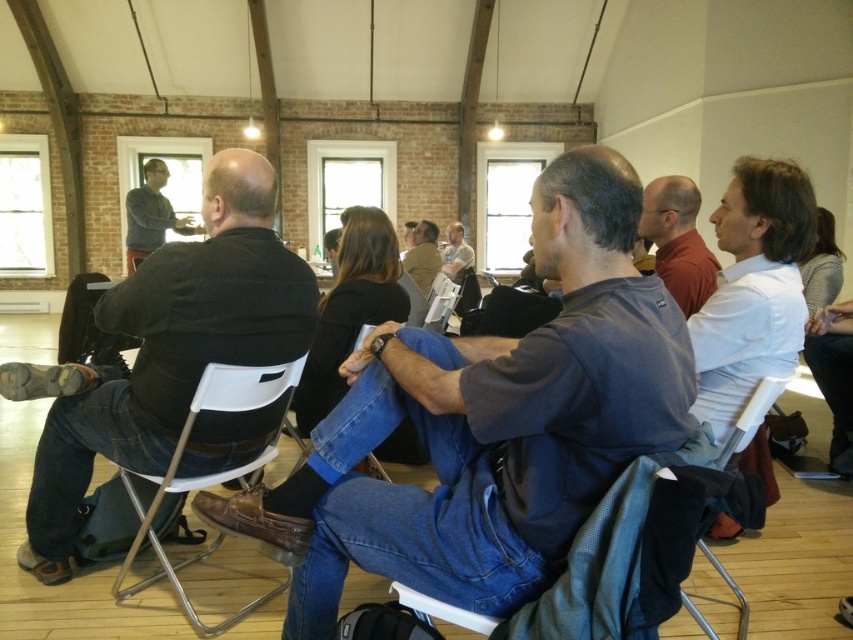
From the picture: You are organizing an event and need to determine if the black leather jacket at left can be placed on the white plastic chair at center without falling off. Based on their sizes, is this possible?

The black leather jacket at left is bigger than the white plastic chair at center, so placing it on the chair may cause it to fall off due to its larger size.

You are standing at the back of the room and want to walk to the front where the presenter is. Which object, the dark blue jeans at center or the white plastic chair at lower left, would you pass closer to as you move forward?

As you move forward from the back of the room, you would pass closer to the dark blue jeans at center because it is closer to the viewer than the white plastic chair at lower left.